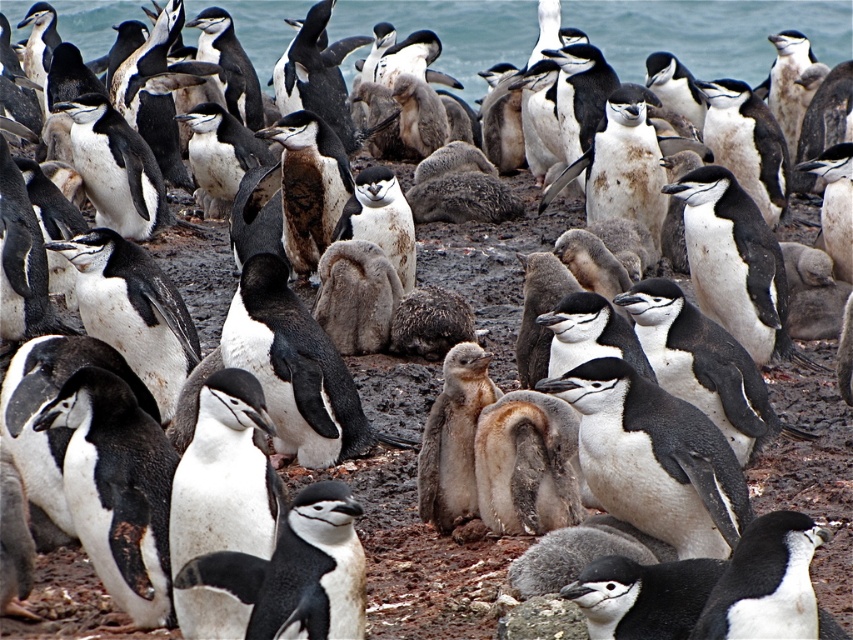
Question: Can you confirm if blue water at upper center is positioned below white matte penguin at center?

Choices:
 (A) no
 (B) yes

Answer: (A)

Question: Can you confirm if blue water at upper center is wider than white matte penguin at center?

Choices:
 (A) yes
 (B) no

Answer: (A)

Question: Can you confirm if blue water at upper center is bigger than white matte penguin at center?

Choices:
 (A) no
 (B) yes

Answer: (B)

Question: Which object is farther from the camera taking this photo?

Choices:
 (A) white matte penguin at center
 (B) blue water at upper center

Answer: (B)

Question: Which object is farther from the camera taking this photo?

Choices:
 (A) blue water at upper center
 (B) white matte penguin at center

Answer: (A)

Question: Which point is farther to the camera?

Choices:
 (A) (752, 3)
 (B) (84, 444)

Answer: (A)